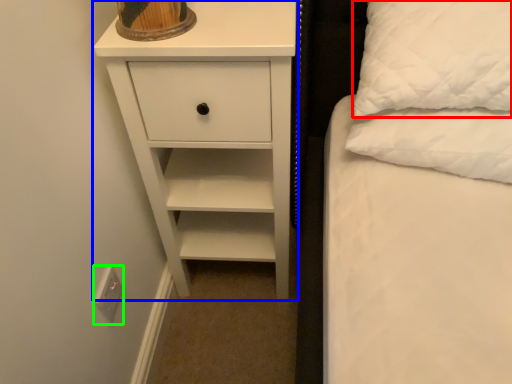
Question: Estimate the real-world distances between objects in this image. Which object is closer to pillow (highlighted by a red box), chest of drawers (highlighted by a blue box) or electric outlet (highlighted by a green box)?

Choices:
 (A) chest of drawers
 (B) electric outlet

Answer: (A)